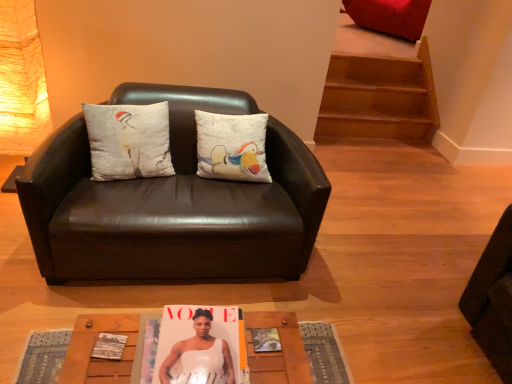
Question: Is matte paper magazine at center smaller than white cotton cushion at center?

Choices:
 (A) yes
 (B) no

Answer: (A)

Question: Is matte paper magazine at center placed right next to white cotton cushion at center?

Choices:
 (A) no
 (B) yes

Answer: (A)

Question: Is matte paper magazine at center completely or partially outside of white cotton cushion at center?

Choices:
 (A) no
 (B) yes

Answer: (B)

Question: From the image's perspective, is matte paper magazine at center located above white cotton cushion at center?

Choices:
 (A) no
 (B) yes

Answer: (A)

Question: Considering the relative positions of matte paper magazine at center and white cotton cushion at center in the image provided, is matte paper magazine at center to the right of white cotton cushion at center from the viewer's perspective?

Choices:
 (A) no
 (B) yes

Answer: (B)

Question: Considering the positions of black leather couch at center and white cotton cushion at center in the image, is black leather couch at center taller or shorter than white cotton cushion at center?

Choices:
 (A) tall
 (B) short

Answer: (A)

Question: From the image's perspective, is black leather couch at center above or below white cotton cushion at center?

Choices:
 (A) below
 (B) above

Answer: (A)

Question: In the image, is black leather couch at center positioned in front of or behind white cotton cushion at center?

Choices:
 (A) front
 (B) behind

Answer: (A)

Question: Considering the positions of black leather couch at center and white cotton cushion at center in the image, is black leather couch at center wider or thinner than white cotton cushion at center?

Choices:
 (A) thin
 (B) wide

Answer: (B)

Question: Considering the positions of wooden textured table at lower center and black leather couch at center in the image, is wooden textured table at lower center taller or shorter than black leather couch at center?

Choices:
 (A) tall
 (B) short

Answer: (B)

Question: In the image, is wooden textured table at lower center on the left side or the right side of black leather couch at center?

Choices:
 (A) right
 (B) left

Answer: (A)

Question: Would you say wooden textured table at lower center is inside or outside black leather couch at center?

Choices:
 (A) outside
 (B) inside

Answer: (A)

Question: From a real-world perspective, is wooden textured table at lower center positioned above or below black leather couch at center?

Choices:
 (A) below
 (B) above

Answer: (A)

Question: In terms of width, does white cotton cushion at center look wider or thinner when compared to matte paper magazine at center?

Choices:
 (A) wide
 (B) thin

Answer: (A)

Question: Would you say white cotton cushion at center is to the left or to the right of matte paper magazine at center in the picture?

Choices:
 (A) right
 (B) left

Answer: (B)